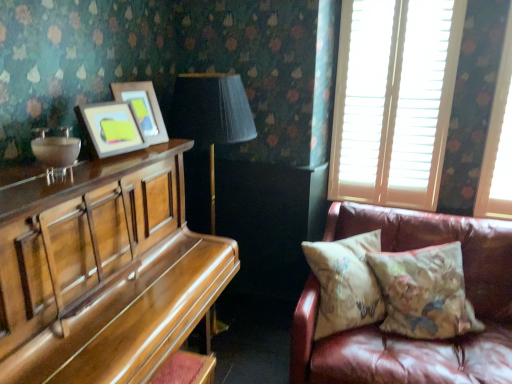
Find the location of a particular element. vacant space underneath matte wooden picture frame at upper left, which is the 2th picture frame from back to front (from a real-world perspective) is located at coordinates (118, 158).